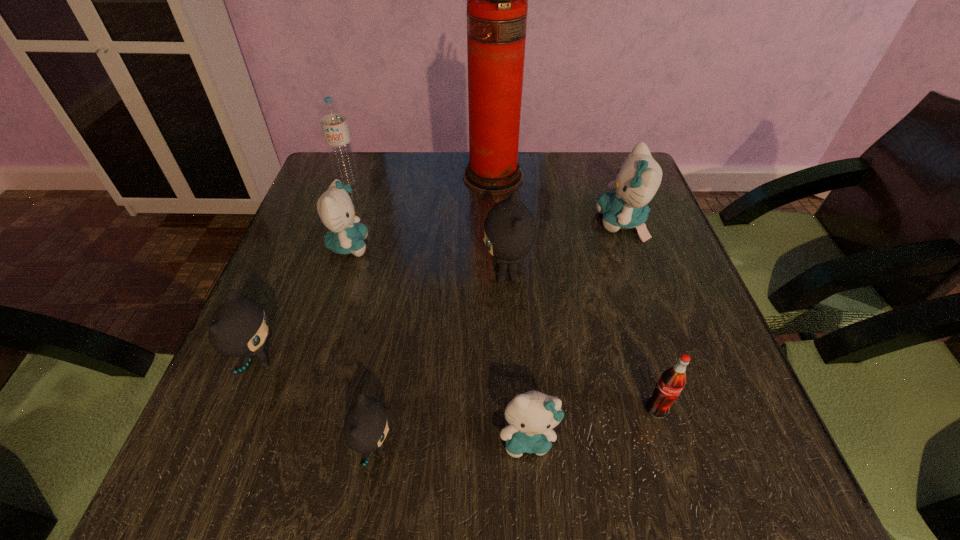
The image size is (960, 540). In order to click on water bottle that is at the far edge in this screenshot , I will do `click(332, 117)`.

At what (x,y) coordinates should I click in order to perform the action: click on water bottle located in the left edge section of the desktop. Please return your answer as a coordinate pair (x, y). The image size is (960, 540). Looking at the image, I should click on (332, 117).

Where is `kitten at the right edge`? kitten at the right edge is located at coordinates (639, 177).

What are the coordinates of `soda bottle located in the right edge section of the desktop` in the screenshot? It's located at (672, 381).

You are a GUI agent. You are given a task and a screenshot of the screen. Output one action in this format:
    pyautogui.click(x=<x>, y=<y>)
    Task: Click on the object present at the far left corner
    
    Given the screenshot: What is the action you would take?
    (x=332, y=117)

The width and height of the screenshot is (960, 540). In the image, there is a desktop. In order to click on free space at the far edge in this screenshot , I will do `click(444, 156)`.

Find the location of a particular element. The width and height of the screenshot is (960, 540). free space at the near edge is located at coordinates (311, 439).

Where is `free region at the right edge of the desktop`? free region at the right edge of the desktop is located at coordinates (654, 228).

The image size is (960, 540). I want to click on vacant point at the far left corner, so click(x=359, y=158).

Image resolution: width=960 pixels, height=540 pixels. In the image, there is a desktop. In order to click on vacant space at the far right corner in this screenshot , I will do `click(578, 155)`.